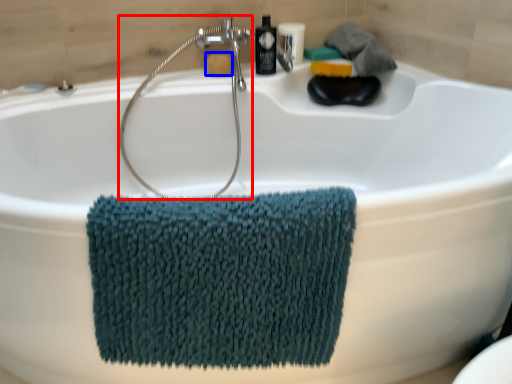
Question: Which object appears farthest to the camera in this image, shower (highlighted by a red box) or soap (highlighted by a blue box)?

Choices:
 (A) shower
 (B) soap

Answer: (B)